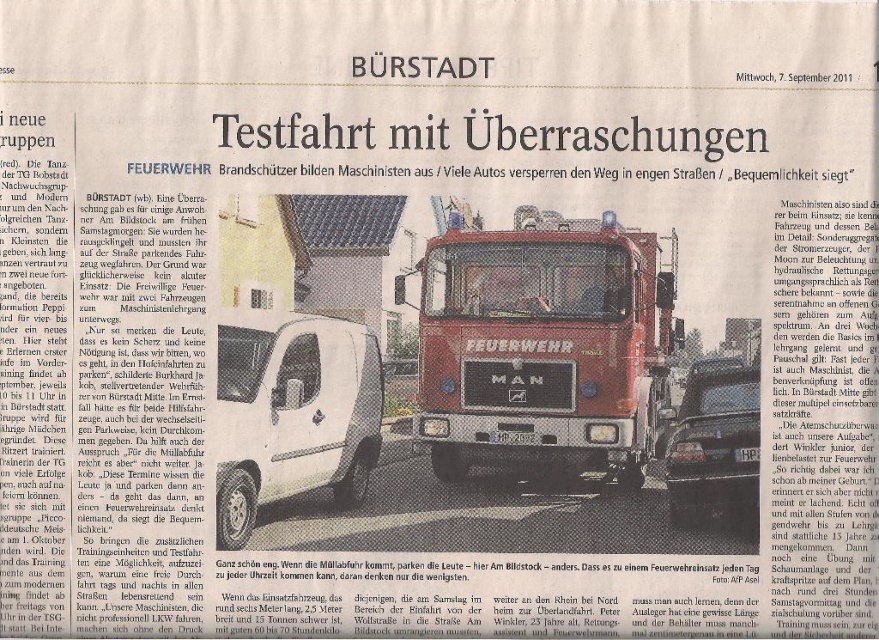
You are a delivery driver who needs to park your van between the red glossy fire truck at center and the shiny black car at center. Can your van, which is 2.5 meters wide, fit in the space between them?

The red glossy fire truck at center is wider than the shiny black car at center. Since the space between them depends on their combined widths, but we only know the comparison of their widths, not the exact measurements, it is impossible to determine if the van can fit without additional information about their exact widths.

You are a pedestrian standing on the sidewalk in front of the red glossy fire truck at center and the shiny black car at center. Which vehicle is closer to you?

The red glossy fire truck at center is closer to you since the shiny black car at center is behind it.